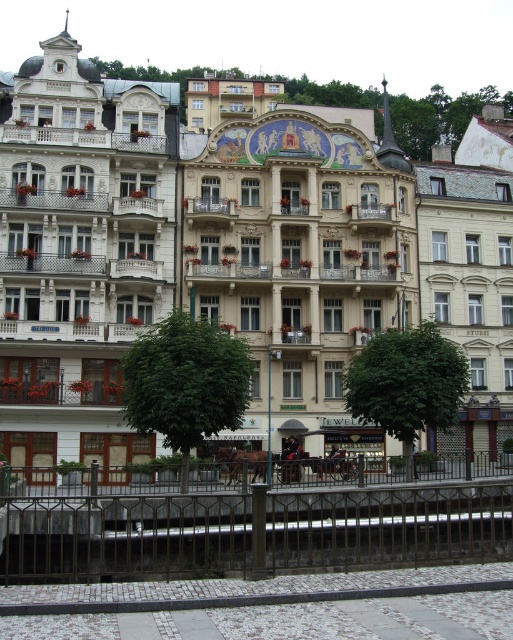
Image resolution: width=513 pixels, height=640 pixels. What do you see at coordinates (80, 256) in the screenshot?
I see `white textured building at left` at bounding box center [80, 256].

Can you confirm if white textured building at left is positioned to the right of white marble balcony at center?

In fact, white textured building at left is to the left of white marble balcony at center.

Measure the distance between white textured building at left and camera.

A distance of 53.38 meters exists between white textured building at left and camera.

The width and height of the screenshot is (513, 640). Find the location of `white textured building at left`. white textured building at left is located at coordinates (80, 256).

Is white stone balcony at center to the left of wooden balcony at center from the viewer's perspective?

In fact, white stone balcony at center is to the right of wooden balcony at center.

Can you confirm if white stone balcony at center is wider than wooden balcony at center?

In fact, white stone balcony at center might be narrower than wooden balcony at center.

Which is behind, point (188, 268) or point (227, 214)?

The point (227, 214) is more distant.

The image size is (513, 640). What are the coordinates of `white stone balcony at center` in the screenshot? It's located at (228, 269).

How distant is white textured building at left from wooden balcony at center?

white textured building at left and wooden balcony at center are 9.02 meters apart from each other.

Is white textured building at left further to camera compared to wooden balcony at center?

No, white textured building at left is closer to the viewer.

Does point (49, 225) come in front of point (215, 196)?

Yes.

Where is `white textured building at left`? The image size is (513, 640). white textured building at left is located at coordinates (80, 256).